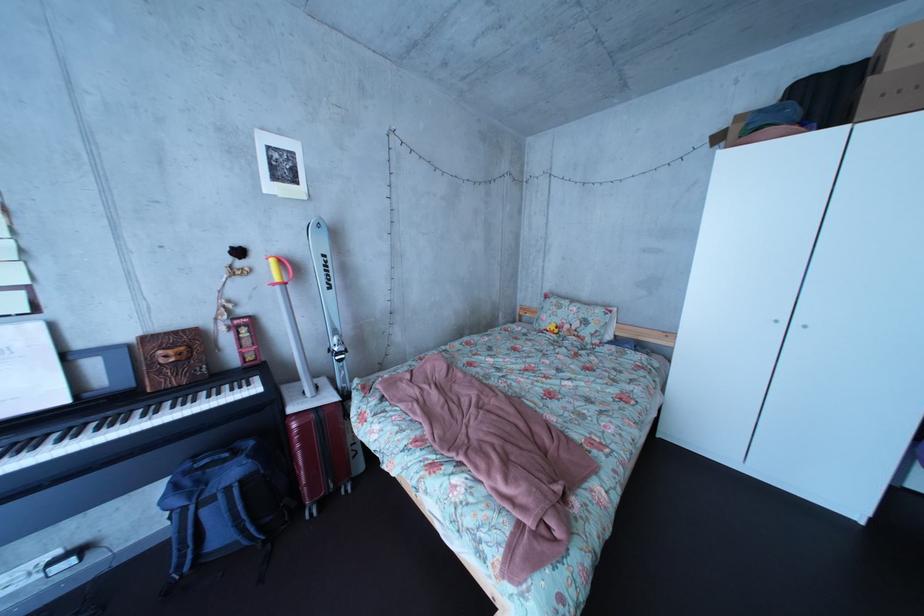
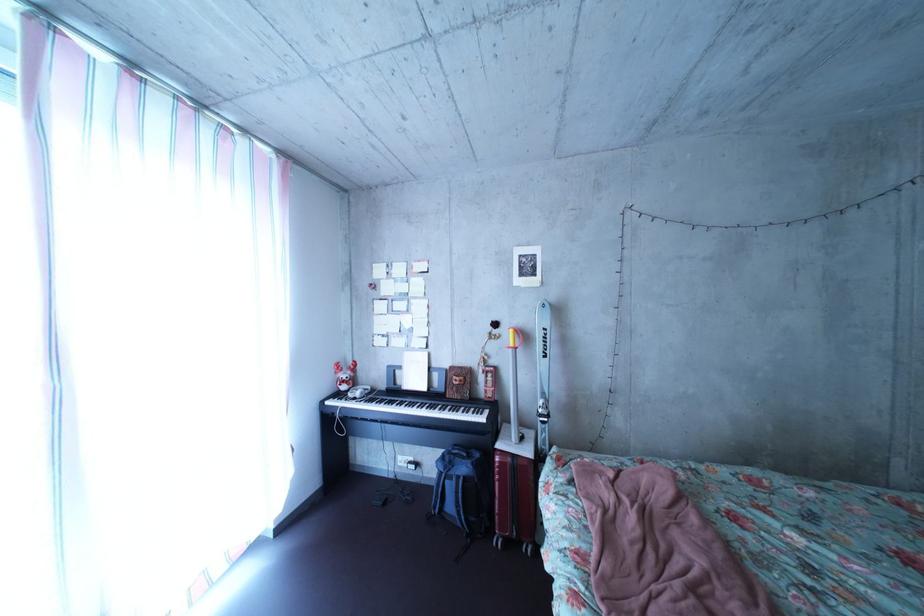
Find the pixel in the second image that matches [254,272] in the first image.

(509, 339)